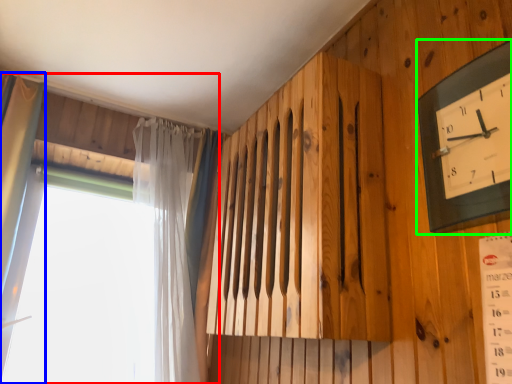
Question: Based on their relative distances, which object is farther from window (highlighted by a red box)? Choose from curtain (highlighted by a blue box) and wall clock (highlighted by a green box).

Choices:
 (A) curtain
 (B) wall clock

Answer: (B)